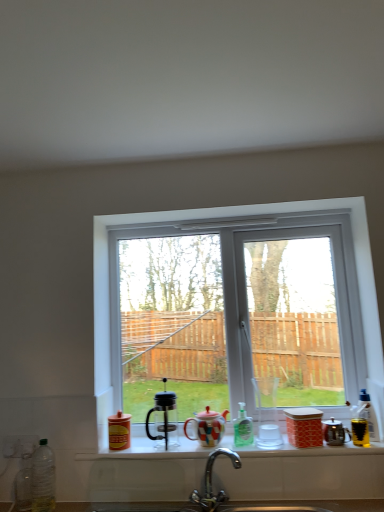
Identify the location of white plastic window at center. (214, 219).

The height and width of the screenshot is (512, 384). What do you see at coordinates (334, 432) in the screenshot?
I see `metallic silver kettle at right, which is the second appliance from left to right` at bounding box center [334, 432].

In order to click on white glossy sink at lower center in this screenshot , I will do `click(330, 504)`.

What do you see at coordinates (164, 418) in the screenshot? The height and width of the screenshot is (512, 384). I see `transparent glass coffee press at center, which is the 1th appliance in left-to-right order` at bounding box center [164, 418].

The image size is (384, 512). Identify the location of green translucent bottle at center, placed as the second bottle when sorted from right to left. (243, 428).

Where is `white plastic window at center`? Image resolution: width=384 pixels, height=512 pixels. white plastic window at center is located at coordinates (214, 219).

Measure the distance from white plastic window at center to metallic gold cup at right, the 3th appliance viewed from the left.

They are 29.95 inches apart.

Looking at this image, which object is wider, white plastic window at center or metallic gold cup at right, arranged as the 1th appliance when viewed from the right?

white plastic window at center.

From a real-world perspective, is white plastic window at center above or below metallic gold cup at right, arranged as the 1th appliance when viewed from the right?

In terms of real-world spatial position, white plastic window at center is above metallic gold cup at right, arranged as the 1th appliance when viewed from the right.

Is white plastic window at center in contact with metallic gold cup at right, the 3th appliance viewed from the left?

No, white plastic window at center is not next to metallic gold cup at right, the 3th appliance viewed from the left.

Which object is positioned more to the left, green translucent bottle at center, positioned as the 2th bottle in left-to-right order, or metallic silver kettle at right, which is the 2th appliance in right-to-left order?

From the viewer's perspective, green translucent bottle at center, positioned as the 2th bottle in left-to-right order, appears more on the left side.

How many degrees apart are the facing directions of green translucent bottle at center, positioned as the 2th bottle in left-to-right order, and metallic silver kettle at right, which is the 2th appliance in right-to-left order?

They differ by 0.00562 degrees in their facing directions.

Measure the distance between green translucent bottle at center, placed as the second bottle when sorted from right to left, and metallic silver kettle at right, which is the 2th appliance in right-to-left order.

green translucent bottle at center, placed as the second bottle when sorted from right to left, and metallic silver kettle at right, which is the 2th appliance in right-to-left order, are 32.83 centimeters apart from each other.

Considering the relative sizes of green translucent bottle at center, placed as the second bottle when sorted from right to left, and metallic silver kettle at right, which is the 2th appliance in right-to-left order, in the image provided, is green translucent bottle at center, placed as the second bottle when sorted from right to left, wider than metallic silver kettle at right, which is the 2th appliance in right-to-left order,?

Correct, the width of green translucent bottle at center, placed as the second bottle when sorted from right to left, exceeds that of metallic silver kettle at right, which is the 2th appliance in right-to-left order.

Identify the location of bottle that is the 2nd one when counting backward from the polished chrome faucet at lower center. The image size is (384, 512). (367, 414).

Looking at this image, who is shorter, polished chrome faucet at lower center or yellow plastic bottle at right, which appears as the first bottle when viewed from the right?

With less height is yellow plastic bottle at right, which appears as the first bottle when viewed from the right.

From the picture: Is polished chrome faucet at lower center outside of yellow plastic bottle at right, which appears as the third bottle when viewed from the left?

Absolutely, polished chrome faucet at lower center is external to yellow plastic bottle at right, which appears as the third bottle when viewed from the left.

Can you see polished chrome faucet at lower center touching yellow plastic bottle at right, which appears as the third bottle when viewed from the left?

No, polished chrome faucet at lower center is not beside yellow plastic bottle at right, which appears as the third bottle when viewed from the left.

From a real-world perspective, is green translucent bottle at center, positioned as the 2th bottle in left-to-right order, physically located above or below white plastic window at center?

In terms of real-world spatial position, green translucent bottle at center, positioned as the 2th bottle in left-to-right order, is below white plastic window at center.

Who is smaller, green translucent bottle at center, positioned as the 2th bottle in left-to-right order, or white plastic window at center?

green translucent bottle at center, positioned as the 2th bottle in left-to-right order.

Is green translucent bottle at center, placed as the second bottle when sorted from right to left, wider or thinner than white plastic window at center?

In the image, green translucent bottle at center, placed as the second bottle when sorted from right to left, appears to be wider than white plastic window at center.

Identify the location of the 1st bottle in front of the white plastic window at center, counting from the anchor's position. This screenshot has width=384, height=512. (243, 428).

The width and height of the screenshot is (384, 512). I want to click on counter top that is on the right side of clear plastic bottle at lower left, the 3th bottle when ordered from right to left, so click(330, 504).

Between white glossy sink at lower center and clear plastic bottle at lower left, the 3th bottle when ordered from right to left, which one appears on the left side from the viewer's perspective?

clear plastic bottle at lower left, the 3th bottle when ordered from right to left.

From the image's perspective, is white glossy sink at lower center located above clear plastic bottle at lower left, the 3th bottle when ordered from right to left?

No, from the image's perspective, white glossy sink at lower center is not over clear plastic bottle at lower left, the 3th bottle when ordered from right to left.

From a real-world perspective, is white glossy sink at lower center on clear plastic bottle at lower left, the 3th bottle when ordered from right to left?

No, from a real-world perspective, white glossy sink at lower center is not over clear plastic bottle at lower left, the 3th bottle when ordered from right to left

Where is `window sill that is in front of the matte ceramic teapot at center`? The height and width of the screenshot is (512, 384). window sill that is in front of the matte ceramic teapot at center is located at coordinates (147, 451).

Is matte glass window sill at center at the left side of matte ceramic teapot at center?

No.

Which object is thinner, matte glass window sill at center or matte ceramic teapot at center?

matte ceramic teapot at center is thinner.

From a real-world perspective, which is physically above, matte glass window sill at center or matte ceramic teapot at center?

matte ceramic teapot at center.

Where is `the 2nd bottle to the right when counting from the matte glass window sill at center`? the 2nd bottle to the right when counting from the matte glass window sill at center is located at coordinates (367, 414).

From a real-world perspective, is yellow plastic bottle at right, which appears as the third bottle when viewed from the left, physically above matte glass window sill at center?

Yes, from a real-world perspective, yellow plastic bottle at right, which appears as the third bottle when viewed from the left, is on top of matte glass window sill at center.

Which of these two, yellow plastic bottle at right, which appears as the third bottle when viewed from the left, or matte glass window sill at center, is wider?

matte glass window sill at center is wider.

Is yellow plastic bottle at right, which appears as the third bottle when viewed from the left, at the left side of matte glass window sill at center?

No, yellow plastic bottle at right, which appears as the third bottle when viewed from the left, is not to the left of matte glass window sill at center.

Locate an element on the screen. The height and width of the screenshot is (512, 384). window above the metallic gold cup at right, arranged as the 1th appliance when viewed from the right (from a real-world perspective) is located at coordinates (214, 219).

This screenshot has height=512, width=384. What are the coordinates of `bottle that is the 2nd object located behind the metallic silver kettle at right, which is the second appliance from left to right` in the screenshot? It's located at (243, 428).

Estimate the real-world distances between objects in this image. Which object is closer to polished chrome faucet at lower center, transparent glass coffee press at center, marked as the third appliance in a right-to-left arrangement, or matte glass window sill at center?

Based on the image, matte glass window sill at center appears to be nearer to polished chrome faucet at lower center.

Which object lies further to the anchor point white glossy sink at lower center, green translucent bottle at center, positioned as the 2th bottle in left-to-right order, or yellow plastic bottle at right, which appears as the first bottle when viewed from the right?

yellow plastic bottle at right, which appears as the first bottle when viewed from the right.

Which object lies further to the anchor point white glossy sink at lower center, green translucent bottle at center, positioned as the 2th bottle in left-to-right order, or clear plastic bottle at lower left, placed as the 1th bottle when sorted from left to right?

Among the two, clear plastic bottle at lower left, placed as the 1th bottle when sorted from left to right, is located further to white glossy sink at lower center.

Which object lies further to the anchor point yellow plastic bottle at right, which appears as the first bottle when viewed from the right, polished chrome faucet at lower center or clear plastic bottle at lower left, the 3th bottle when ordered from right to left?

clear plastic bottle at lower left, the 3th bottle when ordered from right to left, is positioned further to the anchor yellow plastic bottle at right, which appears as the first bottle when viewed from the right.

Which object lies nearer to the anchor point matte glass window sill at center, transparent glass coffee press at center, which is the 1th appliance in left-to-right order, or white glossy sink at lower center?

transparent glass coffee press at center, which is the 1th appliance in left-to-right order, is closer to matte glass window sill at center.

When comparing their distances from green translucent bottle at center, positioned as the 2th bottle in left-to-right order, does yellow plastic bottle at right, which appears as the first bottle when viewed from the right, or clear plastic bottle at lower left, placed as the 1th bottle when sorted from left to right, seem closer?

yellow plastic bottle at right, which appears as the first bottle when viewed from the right, is positioned closer to the anchor green translucent bottle at center, positioned as the 2th bottle in left-to-right order.

Looking at the image, which one is located further to metallic silver kettle at right, which is the 2th appliance in right-to-left order, clear plastic bottle at lower left, placed as the 1th bottle when sorted from left to right, or matte glass window sill at center?

Based on the image, clear plastic bottle at lower left, placed as the 1th bottle when sorted from left to right, appears to be further to metallic silver kettle at right, which is the 2th appliance in right-to-left order.

Looking at this image, looking at the image, which one is located further to green translucent bottle at center, placed as the second bottle when sorted from right to left, white plastic window at center or white glossy sink at lower center?

white plastic window at center lies further to green translucent bottle at center, placed as the second bottle when sorted from right to left, than the other object.

Find the location of a particular element. The height and width of the screenshot is (512, 384). tap located between clear plastic bottle at lower left, the 3th bottle when ordered from right to left, and metallic gold cup at right, the 3th appliance viewed from the left, in the left-right direction is located at coordinates (211, 482).

Find the location of a particular element. counter top between clear plastic bottle at lower left, placed as the 1th bottle when sorted from left to right, and metallic silver kettle at right, which is the 2th appliance in right-to-left order, in the horizontal direction is located at coordinates (330, 504).

Image resolution: width=384 pixels, height=512 pixels. I want to click on window between matte ceramic teapot at center and yellow plastic bottle at right, which appears as the first bottle when viewed from the right, so click(x=214, y=219).

At what (x,y) coordinates should I click in order to perform the action: click on window between polished chrome faucet at lower center and metallic gold cup at right, arranged as the 1th appliance when viewed from the right, from left to right. Please return your answer as a coordinate pair (x, y). The width and height of the screenshot is (384, 512). Looking at the image, I should click on (214, 219).